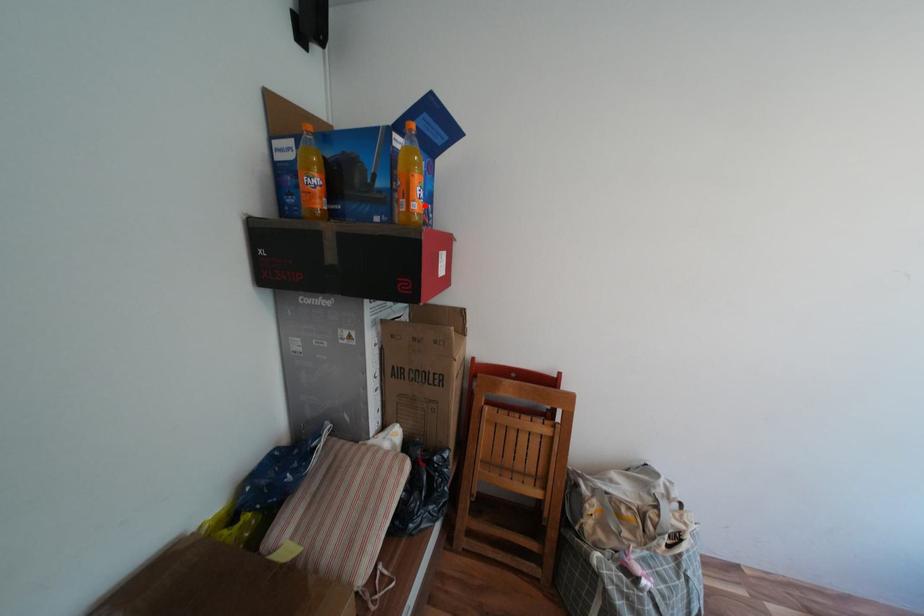
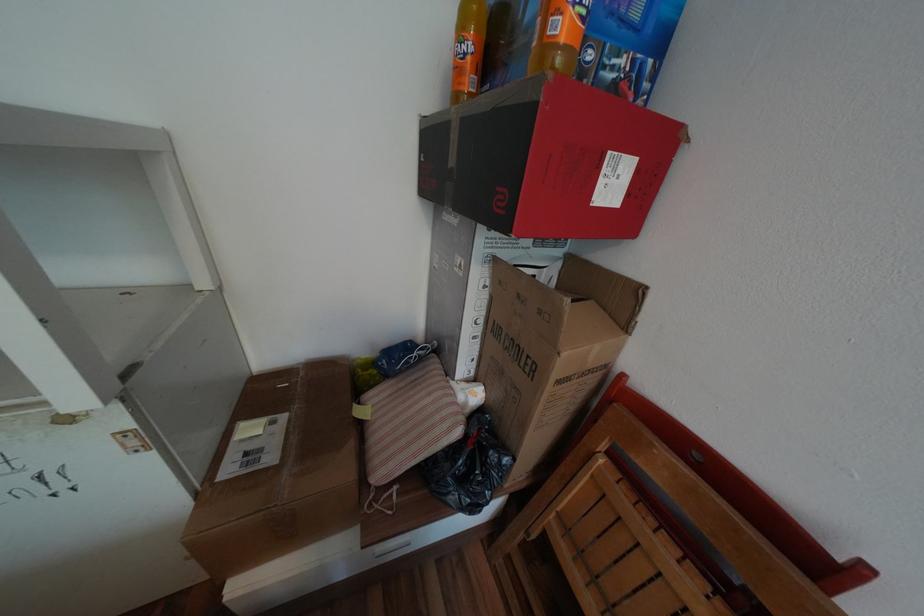
Where in the second image is the point corresponding to the highlighted location from the first image?

(569, 26)